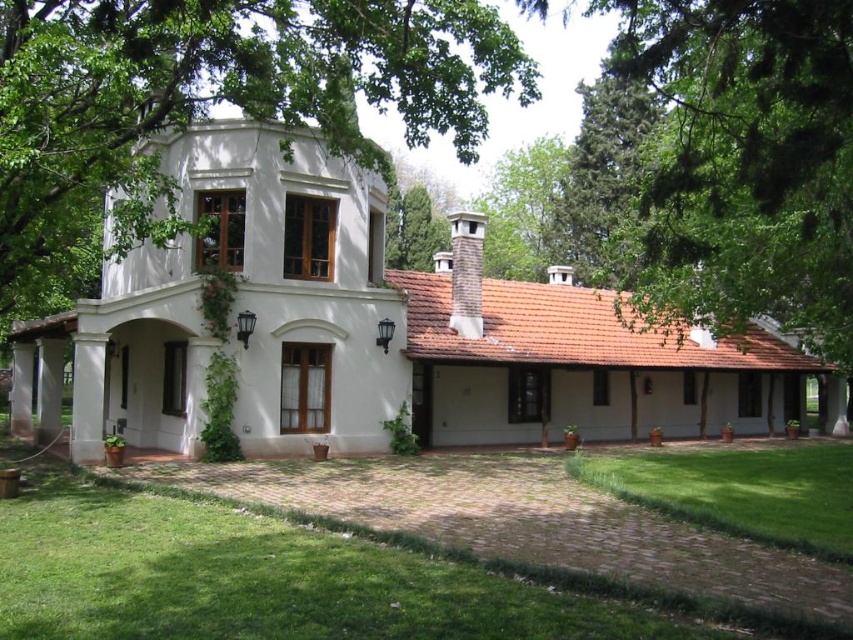
Question: Does green leafy tree at upper center appear under green grass lawn at lower right?

Choices:
 (A) no
 (B) yes

Answer: (A)

Question: Which object is closer to the camera taking this photo?

Choices:
 (A) green leafy tree at upper center
 (B) green grass lawn at lower right

Answer: (A)

Question: Which object is farther from the camera taking this photo?

Choices:
 (A) green leafy tree at upper center
 (B) green grass lawn at lower right

Answer: (B)

Question: Does green leafy tree at upper center appear on the right side of green grass lawn at lower right?

Choices:
 (A) yes
 (B) no

Answer: (B)

Question: Is green leafy tree at upper center wider than green grass lawn at lower right?

Choices:
 (A) no
 (B) yes

Answer: (B)